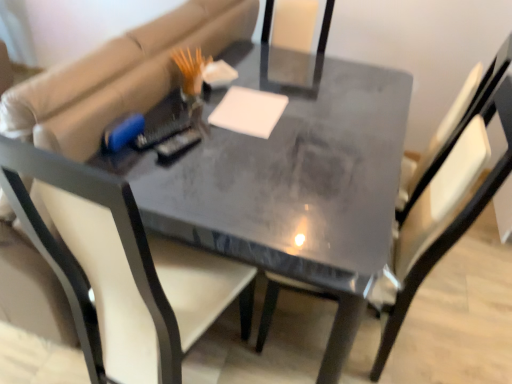
Where is `unoccupied area behind white matte notepad at center`? The width and height of the screenshot is (512, 384). unoccupied area behind white matte notepad at center is located at coordinates (267, 87).